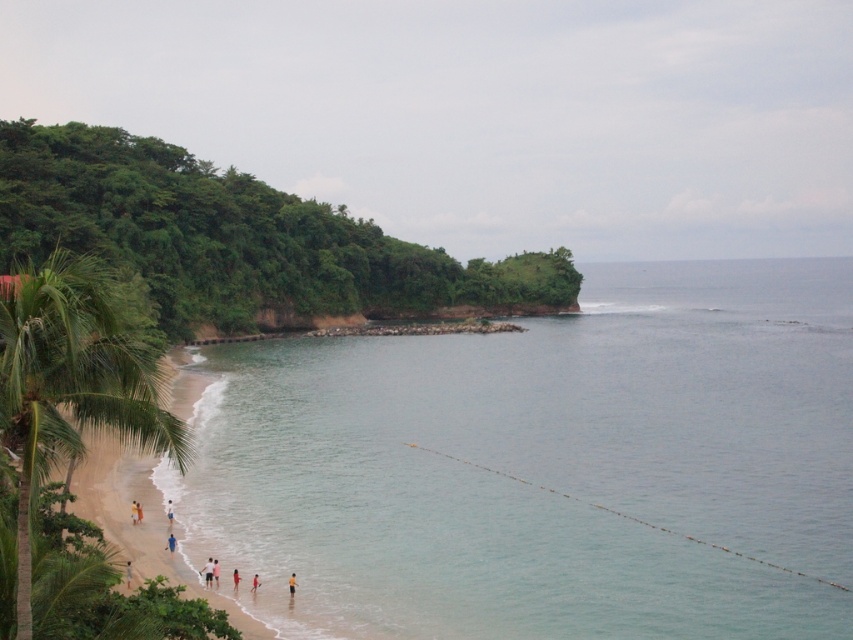
You are a photographer trying to capture a photo of the light pink fabric at lower center and the yellow fabric person at lower center. Based on their sizes in the image, which object would appear larger in your photo?

The light pink fabric at lower center might be wider than the yellow fabric person at lower center, so it could appear larger in the photo.

You are a photographer trying to capture the light pink fabric at lower center in the image. Based on its position, where should you aim your camera to ensure it is centered in your shot?

The light pink fabric at lower center is located at the 2D coordinates point (x=215, y=572), so you should aim your camera at that point to center it in your shot.